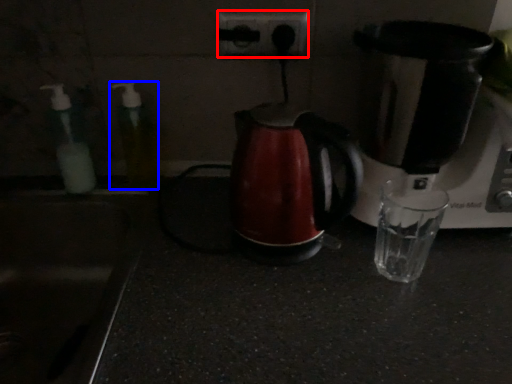
Question: Which object appears closest to the camera in this image, power plugs and sockets (highlighted by a red box) or bottle (highlighted by a blue box)?

Choices:
 (A) power plugs and sockets
 (B) bottle

Answer: (B)